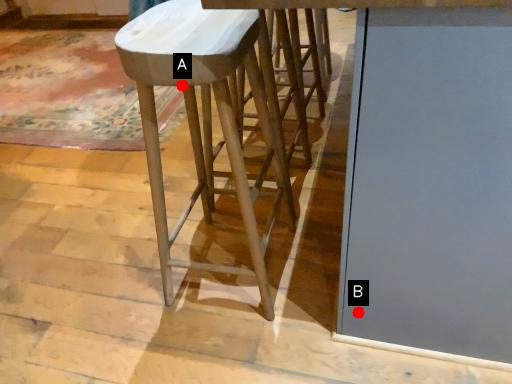
Question: Two points are circled on the image, labeled by A and B beside each circle. Among these points, which one is farthest from the camera?

Choices:
 (A) A is further
 (B) B is further

Answer: (B)